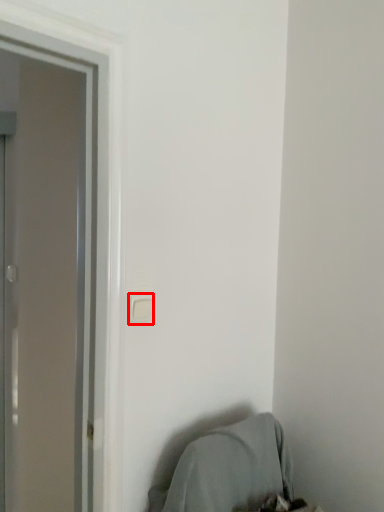
Question: From the image's perspective, where is light switch (annotated by the red box) located relative to bean bag chair?

Choices:
 (A) below
 (B) above

Answer: (B)